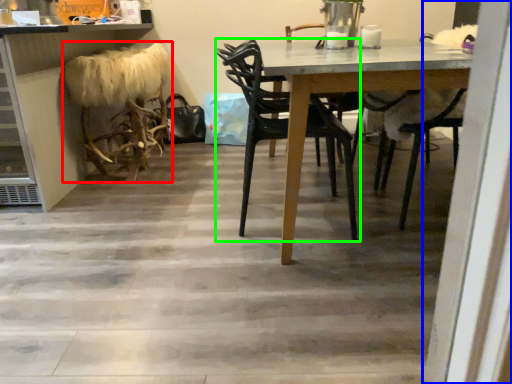
Question: Estimate the real-world distances between objects in this image. Which object is farther from animal (highlighted by a red box), screen door (highlighted by a blue box) or chair (highlighted by a green box)?

Choices:
 (A) screen door
 (B) chair

Answer: (A)